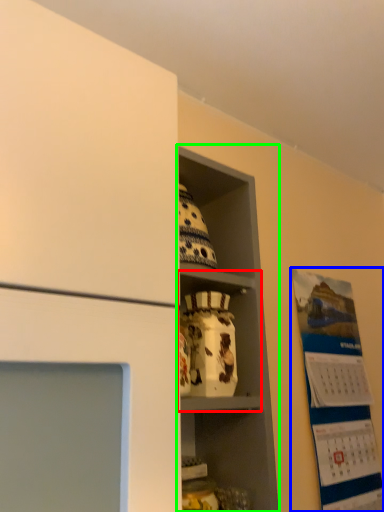
Question: Which is farther away from cabinet (highlighted by a red box)? bulletin board (highlighted by a blue box) or shelf (highlighted by a green box)?

Choices:
 (A) bulletin board
 (B) shelf

Answer: (A)